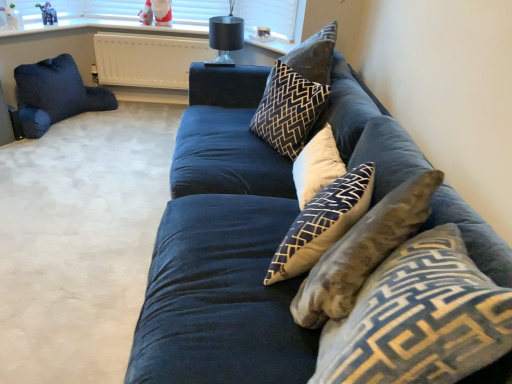
Question: Does dark blue velvet pillow at left, the 1th pillow from the left, come behind matte plastic santa at upper center, which appears as the 1th toy when viewed from the back?

Choices:
 (A) yes
 (B) no

Answer: (B)

Question: Is dark blue velvet pillow at left, which is the first pillow from back to front, at the right side of matte plastic santa at upper center, the third toy from the front?

Choices:
 (A) no
 (B) yes

Answer: (A)

Question: Could matte plastic santa at upper center, which appears as the first toy when viewed from the right, be considered to be inside dark blue velvet pillow at left, which is the first pillow from back to front?

Choices:
 (A) no
 (B) yes

Answer: (A)

Question: Can you confirm if dark blue velvet pillow at left, the 1th pillow from the left, is thinner than matte plastic santa at upper center, which appears as the 1th toy when viewed from the back?

Choices:
 (A) no
 (B) yes

Answer: (A)

Question: Does dark blue velvet pillow at left, which is the 5th pillow from right to left, have a lesser height compared to matte plastic santa at upper center, which appears as the first toy when viewed from the right?

Choices:
 (A) no
 (B) yes

Answer: (A)

Question: Relative to white cotton cushion at center, the fourth pillow positioned from the back, is dark blue velvet pillow at left, which is the fifth pillow from front to back, in front or behind?

Choices:
 (A) front
 (B) behind

Answer: (B)

Question: Is dark blue velvet pillow at left, which is the first pillow from back to front, inside the boundaries of white cotton cushion at center, which is the second pillow from front to back, or outside?

Choices:
 (A) outside
 (B) inside

Answer: (A)

Question: From the image's perspective, is dark blue velvet pillow at left, the 1th pillow from the left, above or below white cotton cushion at center, the fourth pillow positioned from the back?

Choices:
 (A) below
 (B) above

Answer: (B)

Question: In the image, is dark blue velvet pillow at left, the 1th pillow from the left, on the left side or the right side of white cotton cushion at center, placed as the third pillow when sorted from right to left?

Choices:
 (A) left
 (B) right

Answer: (A)

Question: From the image's perspective, relative to matte plastic elephant at upper left, the 2th toy viewed from the right, is white matte radiator at upper center above or below?

Choices:
 (A) below
 (B) above

Answer: (A)

Question: Is white matte radiator at upper center spatially inside matte plastic elephant at upper left, the second toy from the left, or outside of it?

Choices:
 (A) outside
 (B) inside

Answer: (A)

Question: Looking at the image, does white matte radiator at upper center seem bigger or smaller compared to matte plastic elephant at upper left, the 2th toy in the back-to-front sequence?

Choices:
 (A) small
 (B) big

Answer: (B)

Question: In the image, is white matte radiator at upper center positioned in front of or behind matte plastic elephant at upper left, the second toy from the left?

Choices:
 (A) front
 (B) behind

Answer: (B)

Question: Based on their positions, is white soft cushion at center, acting as the 1th pillow starting from the right, located to the left or right of navy blue fabric couch at center?

Choices:
 (A) left
 (B) right

Answer: (B)

Question: From the image's perspective, is white soft cushion at center, which is the 3th pillow from back to front, above or below navy blue fabric couch at center?

Choices:
 (A) below
 (B) above

Answer: (B)